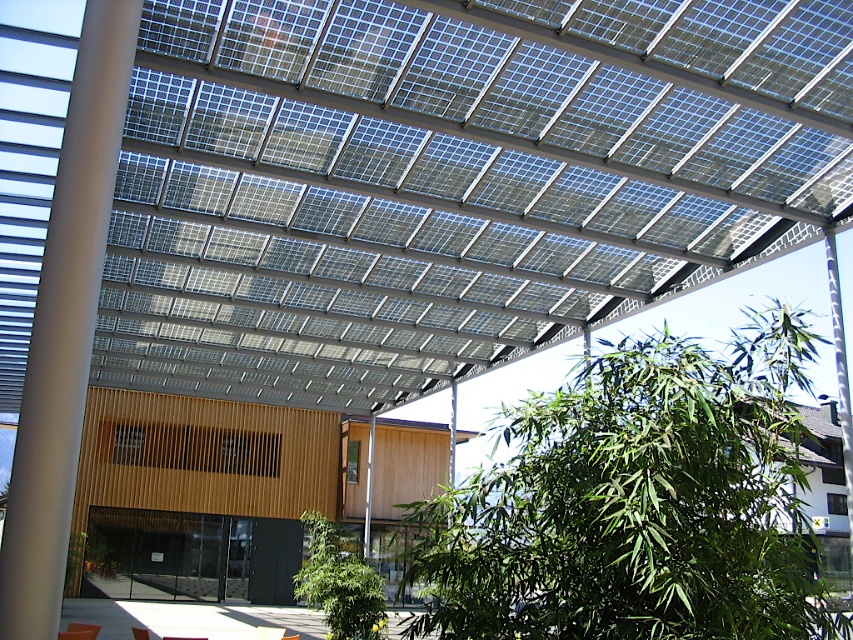
Question: Which of the following is the closest to the observer?

Choices:
 (A) (318, 282)
 (B) (96, 221)
 (C) (321, 560)
 (D) (722, 380)

Answer: (D)

Question: Which point is farther from the camera taking this photo?

Choices:
 (A) (193, 301)
 (B) (80, 288)

Answer: (A)

Question: Does transparent glass panels at upper center appear on the left side of white smooth pillar at left?

Choices:
 (A) yes
 (B) no

Answer: (A)

Question: Is the position of transparent glass panels at upper center more distant than that of green leafy tree at center?

Choices:
 (A) no
 (B) yes

Answer: (B)

Question: Is white smooth pillar at left below green leafy plant at center?

Choices:
 (A) no
 (B) yes

Answer: (A)

Question: Which point is farther to the camera?

Choices:
 (A) white smooth pillar at left
 (B) green leafy plant at center

Answer: (B)